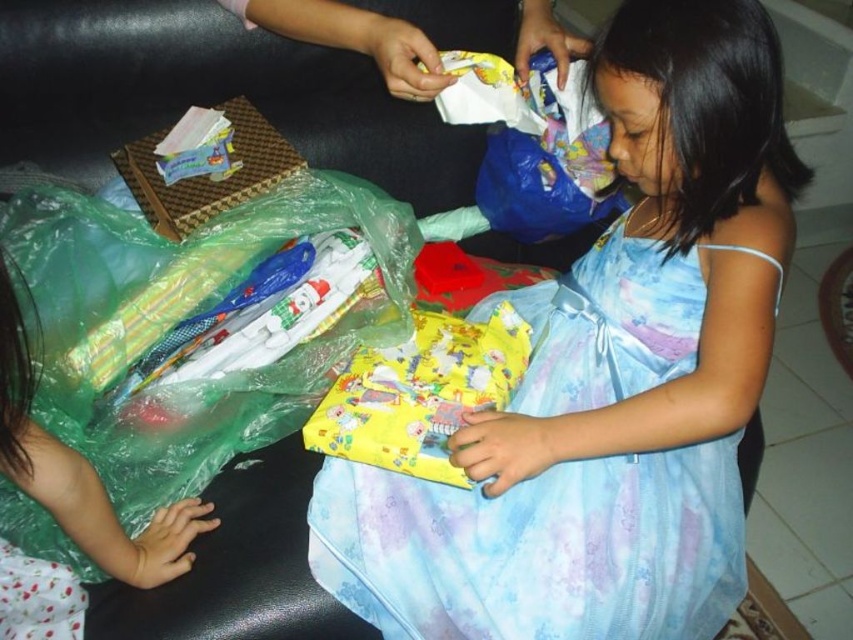
You are a tailor trying to decide whether to place a new accessory on the light blue satin dress at center or the translucent green plastic bag at lower left. Based on their widths, which item would you choose to place the accessory on?

The light blue satin dress at center is wider than the translucent green plastic bag at lower left, so the accessory should be placed on the light blue satin dress at center.

Based on the photo, you are a parent observing the scene. You notice the translucent green plastic bag at lower left and the yellow paper gift at center. Which object is closer to you?

The translucent green plastic bag at lower left is closer to you because it is in front of the yellow paper gift at center.

You are standing in the living room and want to place a small vase on the coffee table. The coffee table is located at point (555, 506). If you are currently 3.46 feet away from the table, can you comfortably reach it without moving closer?

The distance between you and the coffee table at point (555, 506) is 3.46 feet. Since this distance is within a comfortable reaching range, you can likely place the vase without needing to move closer.